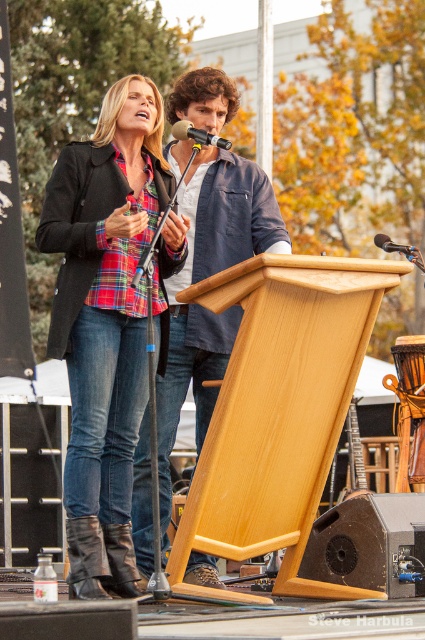
You are a photographer standing at point [207,83]. You need to take a photo of the two people behind the podium. Can you fit both of them in the frame if your camera has a 50mm lens?

The two people are 27.23 meters apart. With a 50mm lens, the field of view is approximately 46 degrees. At this distance, the angle between the two subjects would be too small to capture both in a single frame.

You are a photographer at the event and want to capture a photo where both the plaid fabric shirt at center and the leather boots at lower left are visible. Considering their sizes, which object should you focus on to ensure both are in frame?

The plaid fabric shirt at center is much taller than the leather boots at lower left, so focusing on the plaid fabric shirt at center would ensure both are visible in the photo.

You are standing in front of the wooden podium at the event. You notice two points marked on the podium. The first point is at coordinate point (x=214, y=125) and the second point is at coordinate point (x=192, y=131). If you want to place a small decoration closer to the camera, which point should you choose?

You should choose point (x=214, y=125) because it is further to the camera than point (x=192, y=131).